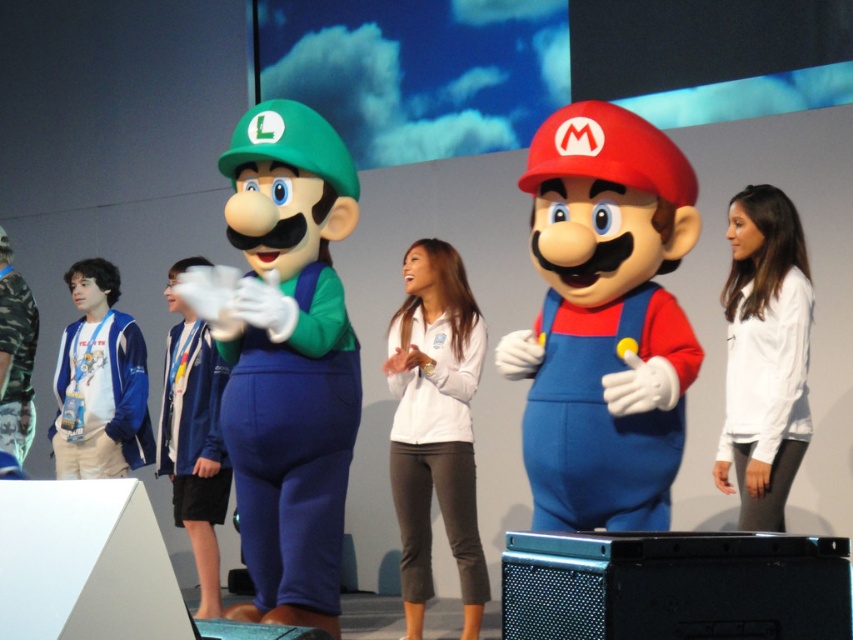
You are a photographer setting up for a group photo. You need to ensure that both the white matte jacket at center and the camo fabric shirt at left are fully visible in the photo. Based on their positions, which clothing item should you adjust to avoid blocking the other?

The camo fabric shirt at left is behind the white matte jacket at center. To ensure both are visible, you should adjust the camo fabric shirt at left to move it forward so it is no longer blocked by the white matte jacket at center.

You are a photographer setting up for a photo shoot with the green fabric luigi at center and the blue fleece jacket at center. You want to ensure that both subjects are fully visible in the photo. Based on their positions, which subject should you focus on first to avoid any overlap?

The green fabric luigi at center is in front of the blue fleece jacket at center, so you should focus on the blue fleece jacket at center first to ensure it is fully visible behind Luigi.

You are a costume designer preparing to measure two outfits for a play. You have the white matte jacket at center and the camo fabric shirt at left. Which one requires more fabric to make?

The white matte jacket at center requires more fabric because it is bigger than the camo fabric shirt at left.